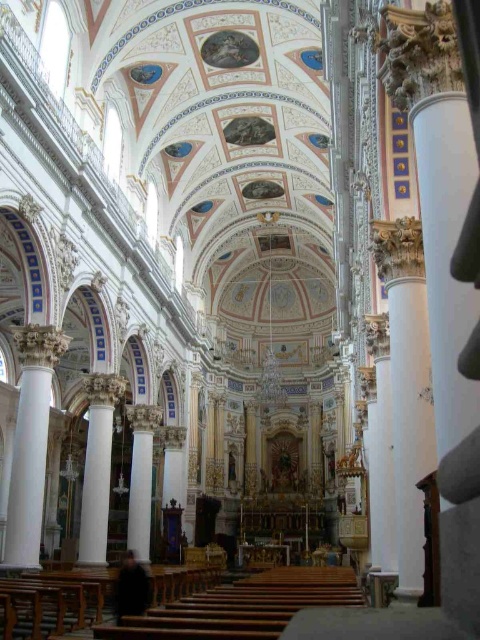
Does white marble column at left have a smaller size compared to white marble column at center?

Correct, white marble column at left occupies less space than white marble column at center.

Between white marble column at left and white marble column at center, which one appears on the left side from the viewer's perspective?

white marble column at left

Which is in front, point (17, 554) or point (132, 468)?

Positioned in front is point (17, 554).

The height and width of the screenshot is (640, 480). Identify the location of white marble column at left. (31, 442).